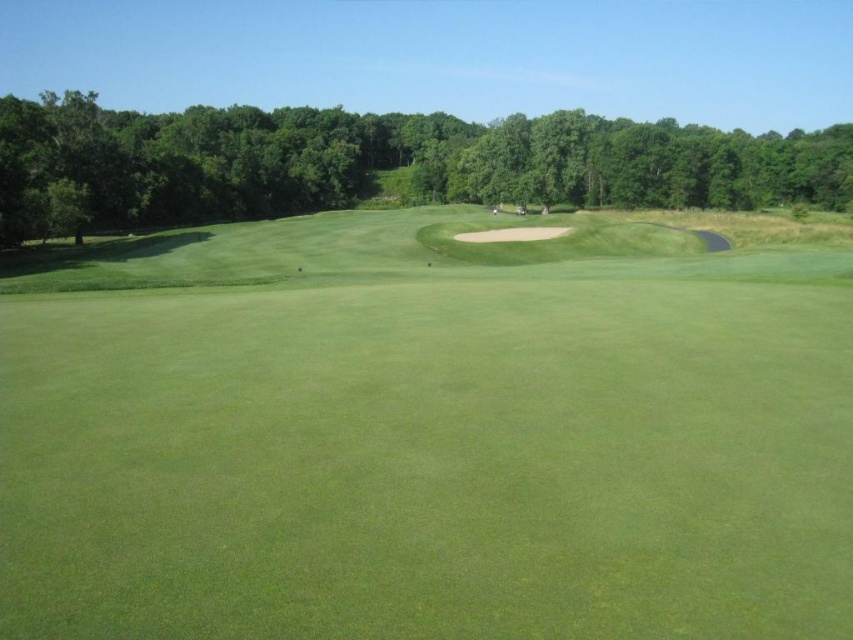
Can you confirm if green grassy fairway at center is positioned to the right of green leafy tree at upper center?

No, green grassy fairway at center is not to the right of green leafy tree at upper center.

Which is behind, point (737, 512) or point (39, 225)?

The point (39, 225) is more distant.

Where is `green grassy fairway at center`? Image resolution: width=853 pixels, height=640 pixels. green grassy fairway at center is located at coordinates (428, 435).